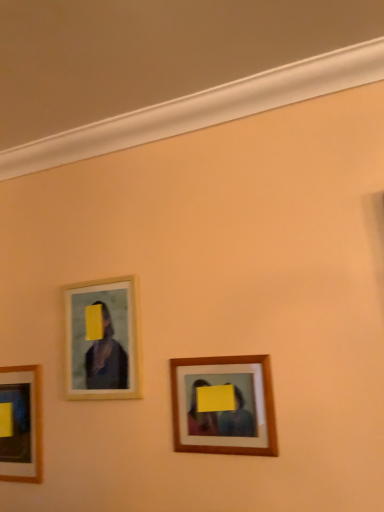
How much space does matte wooden picture frame at lower left, positioned as the 3th picture frame in right-to-left order, occupy horizontally?

matte wooden picture frame at lower left, positioned as the 3th picture frame in right-to-left order, is 1.47 inches wide.

This screenshot has width=384, height=512. What do you see at coordinates (224, 405) in the screenshot?
I see `wooden frame at center, arranged as the 1th picture frame when viewed from the front` at bounding box center [224, 405].

Where is `matte wooden picture frame at lower left, placed as the 3th picture frame when sorted from front to back`? This screenshot has width=384, height=512. matte wooden picture frame at lower left, placed as the 3th picture frame when sorted from front to back is located at coordinates (25, 423).

From a real-world perspective, is wooden frame at center, arranged as the 1th picture frame when viewed from the front, above or below wooden frame at upper left, which is the 2th picture frame in left-to-right order?

Clearly, from a real-world perspective, wooden frame at center, arranged as the 1th picture frame when viewed from the front, is below wooden frame at upper left, which is the 2th picture frame in left-to-right order.

Does point (229, 397) come closer to viewer compared to point (70, 398)?

Yes, point (229, 397) is closer to viewer.

What's the angular difference between wooden frame at center, the third picture frame from the back, and wooden frame at upper left, the 2th picture frame when ordered from back to front,'s facing directions?

0.246 degrees.

Which object is more forward, wooden frame at center, acting as the first picture frame starting from the right, or wooden frame at upper left, the second picture frame when ordered from right to left?

wooden frame at center, acting as the first picture frame starting from the right, is in front.

From the image's perspective, is wooden frame at center, placed as the third picture frame when sorted from left to right, above or below matte wooden picture frame at lower left, the first picture frame positioned from the left?

Clearly, from the image's perspective, wooden frame at center, placed as the third picture frame when sorted from left to right, is above matte wooden picture frame at lower left, the first picture frame positioned from the left.

Can you confirm if wooden frame at center, acting as the first picture frame starting from the right, is taller than matte wooden picture frame at lower left, which is counted as the 1th picture frame, starting from the back?

In fact, wooden frame at center, acting as the first picture frame starting from the right, may be shorter than matte wooden picture frame at lower left, which is counted as the 1th picture frame, starting from the back.

Is point (217, 386) farther from viewer compared to point (39, 444)?

No.

Considering the relative sizes of wooden frame at upper left, positioned as the second picture frame in front-to-back order, and wooden frame at center, acting as the first picture frame starting from the right, in the image provided, is wooden frame at upper left, positioned as the second picture frame in front-to-back order, smaller than wooden frame at center, acting as the first picture frame starting from the right,?

Incorrect, wooden frame at upper left, positioned as the second picture frame in front-to-back order, is not smaller in size than wooden frame at center, acting as the first picture frame starting from the right.

Choose the correct answer: Is wooden frame at upper left, positioned as the second picture frame in front-to-back order, inside wooden frame at center, arranged as the 1th picture frame when viewed from the front, or outside it?

wooden frame at upper left, positioned as the second picture frame in front-to-back order, is outside wooden frame at center, arranged as the 1th picture frame when viewed from the front.

From the image's perspective, who appears lower, wooden frame at upper left, which is the 2th picture frame in left-to-right order, or wooden frame at center, acting as the first picture frame starting from the right?

wooden frame at center, acting as the first picture frame starting from the right, is shown below in the image.

From a real-world perspective, which is physically below, wooden frame at upper left, the 2th picture frame when ordered from back to front, or wooden frame at center, acting as the first picture frame starting from the right?

wooden frame at center, acting as the first picture frame starting from the right, is physically lower.

This screenshot has height=512, width=384. I want to click on picture frame on the left of wooden frame at upper left, the second picture frame when ordered from right to left, so click(x=25, y=423).

Looking at this image, from a real-world perspective, relative to matte wooden picture frame at lower left, the first picture frame positioned from the left, is wooden frame at upper left, which is the 2th picture frame in left-to-right order, vertically above or below?

wooden frame at upper left, which is the 2th picture frame in left-to-right order, is situated higher than matte wooden picture frame at lower left, the first picture frame positioned from the left, in the real world.

Which of these two, wooden frame at upper left, the 2th picture frame when ordered from back to front, or matte wooden picture frame at lower left, placed as the 3th picture frame when sorted from front to back, stands shorter?

Standing shorter between the two is wooden frame at upper left, the 2th picture frame when ordered from back to front.

Does wooden frame at upper left, the 2th picture frame when ordered from back to front, have a greater width compared to matte wooden picture frame at lower left, which is counted as the 1th picture frame, starting from the back?

No, wooden frame at upper left, the 2th picture frame when ordered from back to front, is not wider than matte wooden picture frame at lower left, which is counted as the 1th picture frame, starting from the back.

Is point (34, 465) more distant than point (76, 331)?

No, it is in front of (76, 331).

Based on the photo, is matte wooden picture frame at lower left, the first picture frame positioned from the left, touching wooden frame at upper left, positioned as the second picture frame in front-to-back order?

No, matte wooden picture frame at lower left, the first picture frame positioned from the left, is not next to wooden frame at upper left, positioned as the second picture frame in front-to-back order.

Considering the relative sizes of matte wooden picture frame at lower left, the first picture frame positioned from the left, and wooden frame at upper left, positioned as the second picture frame in front-to-back order, in the image provided, is matte wooden picture frame at lower left, the first picture frame positioned from the left, thinner than wooden frame at upper left, positioned as the second picture frame in front-to-back order,?

No, matte wooden picture frame at lower left, the first picture frame positioned from the left, is not thinner than wooden frame at upper left, positioned as the second picture frame in front-to-back order.

From a real-world perspective, who is located higher, matte wooden picture frame at lower left, positioned as the 3th picture frame in right-to-left order, or wooden frame at upper left, positioned as the second picture frame in front-to-back order?

wooden frame at upper left, positioned as the second picture frame in front-to-back order.

Does point (35, 392) lie behind point (228, 426)?

Yes.

Consider the image. Does matte wooden picture frame at lower left, which is counted as the 1th picture frame, starting from the back, have a smaller size compared to wooden frame at center, arranged as the 1th picture frame when viewed from the front?

No.

How different are the orientations of matte wooden picture frame at lower left, positioned as the 3th picture frame in right-to-left order, and wooden frame at center, acting as the first picture frame starting from the right, in degrees?

matte wooden picture frame at lower left, positioned as the 3th picture frame in right-to-left order, and wooden frame at center, acting as the first picture frame starting from the right, are facing 0.488 degrees away from each other.

How far apart are matte wooden picture frame at lower left, the first picture frame positioned from the left, and wooden frame at center, placed as the third picture frame when sorted from left to right?

The distance of matte wooden picture frame at lower left, the first picture frame positioned from the left, from wooden frame at center, placed as the third picture frame when sorted from left to right, is 28.39 inches.

Locate an element on the screen. This screenshot has height=512, width=384. the 1st picture frame below when counting from the wooden frame at upper left, the 2th picture frame when ordered from back to front (from the image's perspective) is located at coordinates (224, 405).

From the image's perspective, which picture frame is the 1st one above the matte wooden picture frame at lower left, the first picture frame positioned from the left? Please provide its 2D coordinates.

[(224, 405)]

Considering their positions, is wooden frame at center, arranged as the 1th picture frame when viewed from the front, positioned closer to matte wooden picture frame at lower left, the first picture frame positioned from the left, than wooden frame at upper left, which is the 2th picture frame in left-to-right order?

Among the two, wooden frame at upper left, which is the 2th picture frame in left-to-right order, is located nearer to matte wooden picture frame at lower left, the first picture frame positioned from the left.

Looking at the image, which one is located closer to wooden frame at upper left, which is the 2th picture frame in left-to-right order, matte wooden picture frame at lower left, which is counted as the 1th picture frame, starting from the back, or wooden frame at center, placed as the third picture frame when sorted from left to right?

matte wooden picture frame at lower left, which is counted as the 1th picture frame, starting from the back, lies closer to wooden frame at upper left, which is the 2th picture frame in left-to-right order, than the other object.

Considering their positions, is wooden frame at upper left, positioned as the second picture frame in front-to-back order, positioned further to wooden frame at center, the third picture frame from the back, than matte wooden picture frame at lower left, positioned as the 3th picture frame in right-to-left order?

A: The object further to wooden frame at center, the third picture frame from the back, is matte wooden picture frame at lower left, positioned as the 3th picture frame in right-to-left order.

Looking at the image, which one is located closer to wooden frame at upper left, the second picture frame when ordered from right to left, wooden frame at center, arranged as the 1th picture frame when viewed from the front, or matte wooden picture frame at lower left, the first picture frame positioned from the left?

matte wooden picture frame at lower left, the first picture frame positioned from the left, is closer to wooden frame at upper left, the second picture frame when ordered from right to left.

When comparing their distances from wooden frame at center, placed as the third picture frame when sorted from left to right, does matte wooden picture frame at lower left, placed as the 3th picture frame when sorted from front to back, or wooden frame at upper left, positioned as the second picture frame in front-to-back order, seem closer?

The object closer to wooden frame at center, placed as the third picture frame when sorted from left to right, is wooden frame at upper left, positioned as the second picture frame in front-to-back order.

Looking at the image, which one is located further to matte wooden picture frame at lower left, positioned as the 3th picture frame in right-to-left order, wooden frame at upper left, the second picture frame when ordered from right to left, or wooden frame at center, the third picture frame from the back?

wooden frame at center, the third picture frame from the back, is positioned further to the anchor matte wooden picture frame at lower left, positioned as the 3th picture frame in right-to-left order.

In order to click on picture frame between matte wooden picture frame at lower left, the first picture frame positioned from the left, and wooden frame at center, placed as the third picture frame when sorted from left to right, from left to right in this screenshot , I will do `click(102, 341)`.